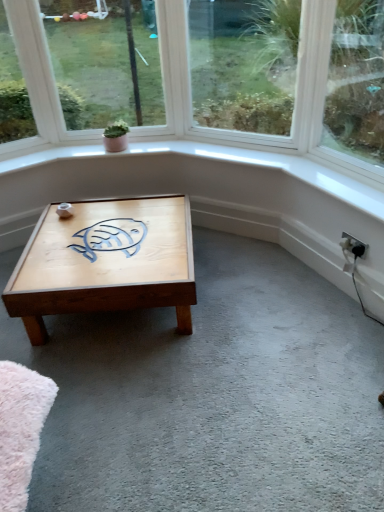
This screenshot has width=384, height=512. Identify the location of free location above light brown wooden coffee table at center (from a real-world perspective). (109, 228).